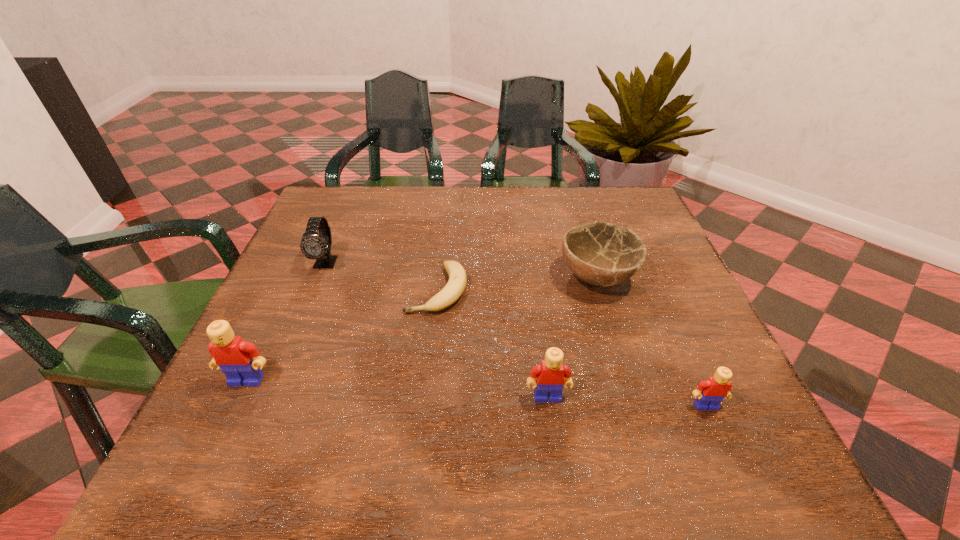
Image resolution: width=960 pixels, height=540 pixels. What are the coordinates of `free location located on the back of the third object from left to right` in the screenshot? It's located at (442, 251).

The width and height of the screenshot is (960, 540). Identify the location of free spot located on the back of the bowl. (578, 214).

You are a GUI agent. You are given a task and a screenshot of the screen. Output one action in this format:
    pyautogui.click(x=<x>, y=<y>)
    Task: Click on the vacant space located on the face of the watch
    
    Given the screenshot: What is the action you would take?
    pyautogui.click(x=307, y=309)

Where is `Lego located at the left edge`? Image resolution: width=960 pixels, height=540 pixels. Lego located at the left edge is located at coordinates (240, 361).

The height and width of the screenshot is (540, 960). Find the location of `watch at the left edge`. watch at the left edge is located at coordinates (314, 245).

The width and height of the screenshot is (960, 540). What are the coordinates of `Lego at the right edge` in the screenshot? It's located at (716, 388).

Locate an element on the screen. The width and height of the screenshot is (960, 540). bowl that is at the right edge is located at coordinates (601, 254).

Locate an element on the screen. This screenshot has height=540, width=960. object present at the near left corner is located at coordinates (240, 361).

The height and width of the screenshot is (540, 960). Identify the location of object present at the near right corner. (716, 388).

Find the location of `blank area at the far edge`. blank area at the far edge is located at coordinates (491, 228).